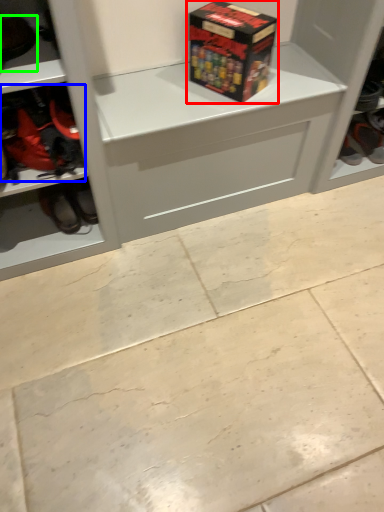
Question: Which object is positioned closest to box (highlighted by a red box)? Select from footwear (highlighted by a blue box) and footwear (highlighted by a green box).

Choices:
 (A) footwear
 (B) footwear

Answer: (A)